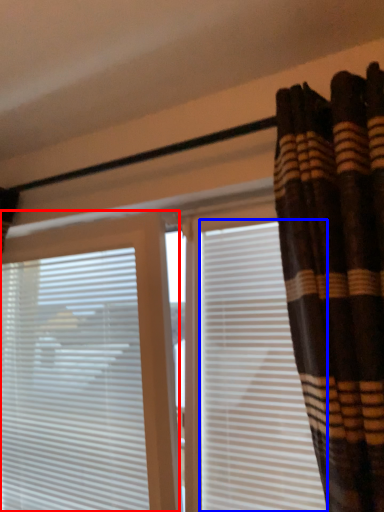
Question: Which of the following is the closest to the observer, window blind (highlighted by a red box) or shutter (highlighted by a blue box)?

Choices:
 (A) window blind
 (B) shutter

Answer: (B)